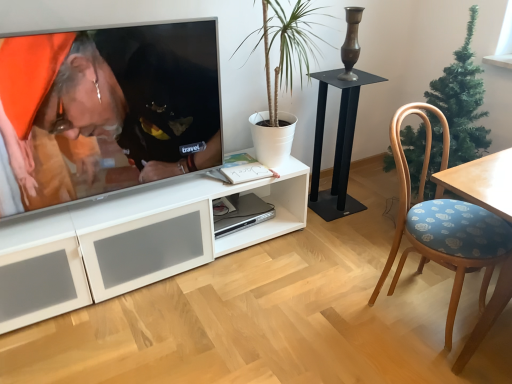
Identify the location of empty space that is to the right of black metal table at center. (371, 207).